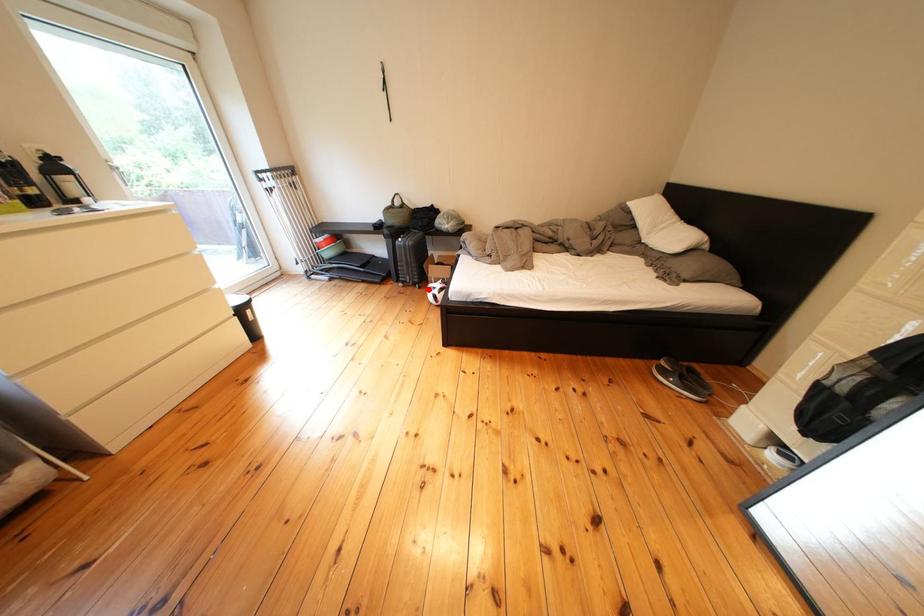
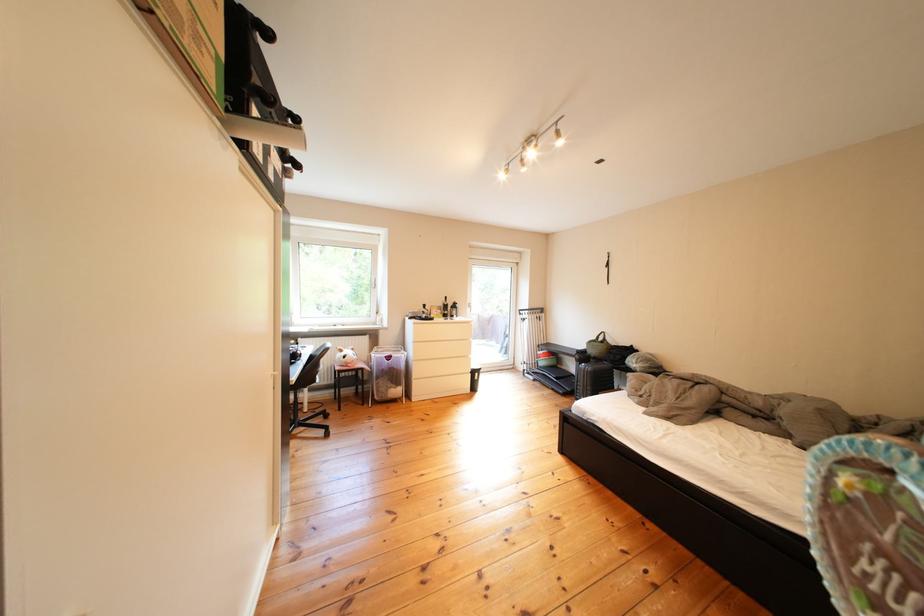
Question: I am providing you with two images of the same scene from different viewpoints. A red point is marked on the first image. Is the red point's position out of view in image 2?

Choices:
 (A) Yes
 (B) No

Answer: (A)